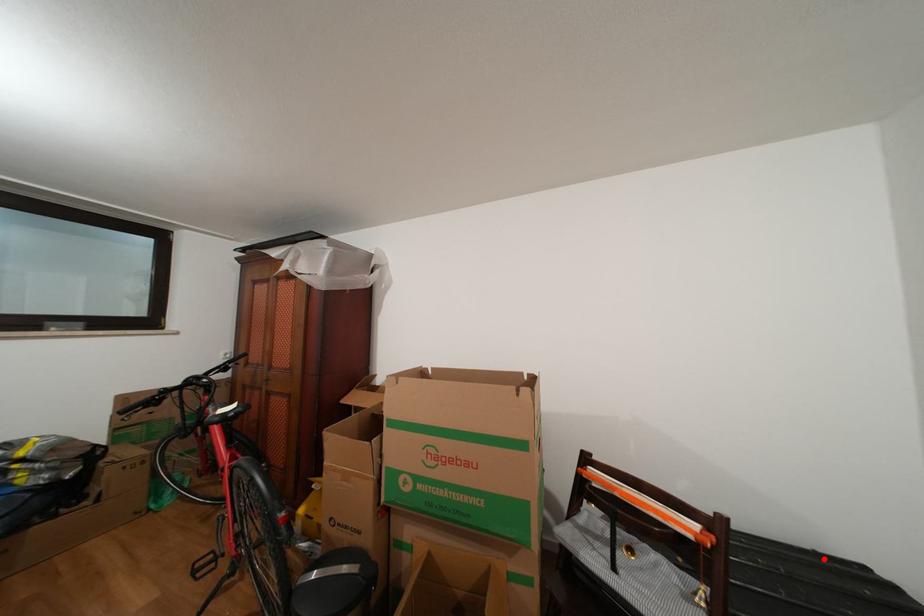
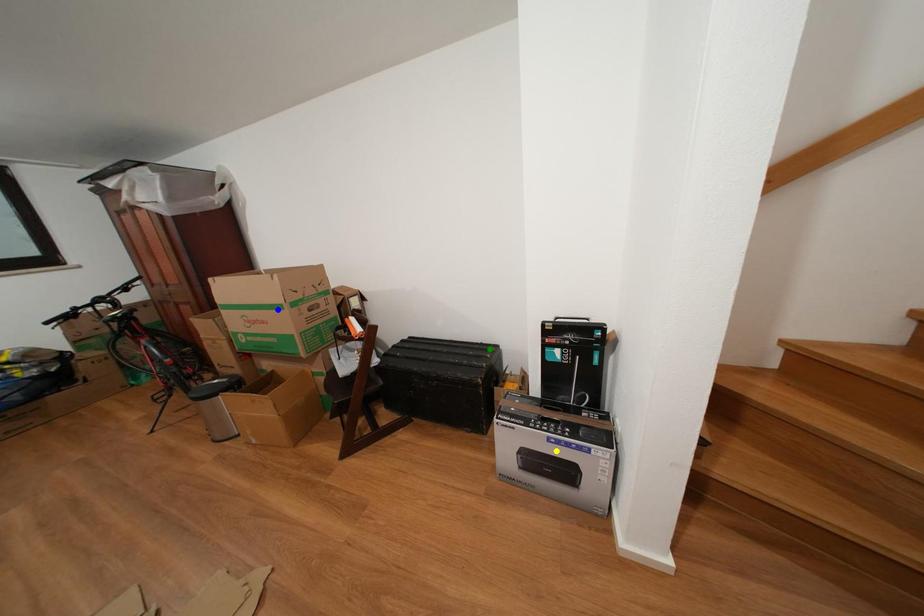
Question: I am providing you with two images of the same scene from different viewpoints. A red point is marked on the first image. You are given multiple points on the second image. Which point in image 2 is actually the same real-world point as the red point in image 1?

Choices:
 (A) blue point
 (B) yellow point
 (C) green point

Answer: (C)